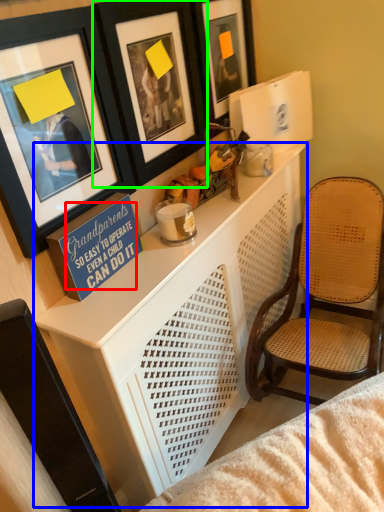
Question: Estimate the real-world distances between objects in this image. Which object is closer to writing (highlighted by a red box), table (highlighted by a blue box) or picture frame (highlighted by a green box)?

Choices:
 (A) table
 (B) picture frame

Answer: (A)